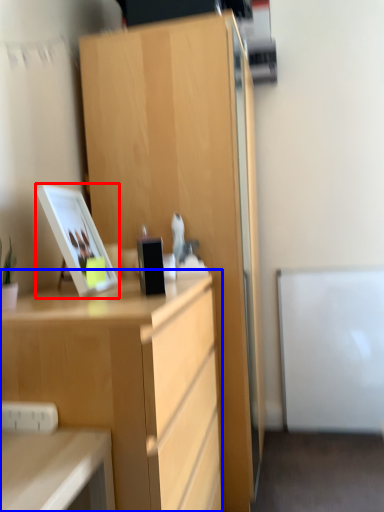
Question: Which object appears farthest to the camera in this image, picture frame (highlighted by a red box) or desk (highlighted by a blue box)?

Choices:
 (A) picture frame
 (B) desk

Answer: (A)